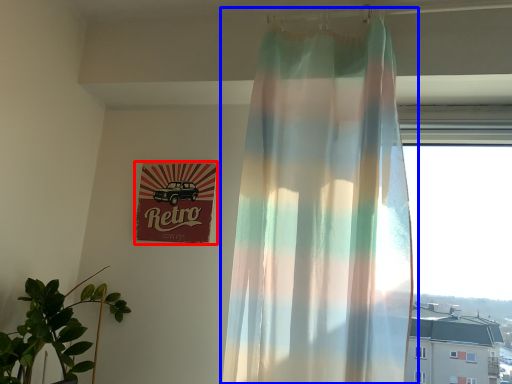
Question: Which point is further to the camera, signage (highlighted by a red box) or curtain (highlighted by a blue box)?

Choices:
 (A) signage
 (B) curtain

Answer: (A)